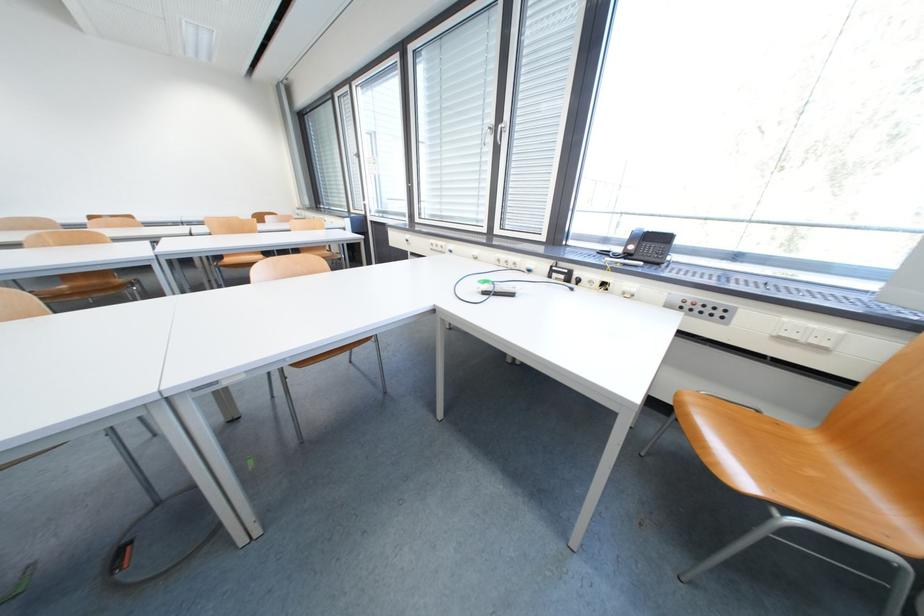
Where is `silver window handle`? The height and width of the screenshot is (616, 924). silver window handle is located at coordinates (501, 131).